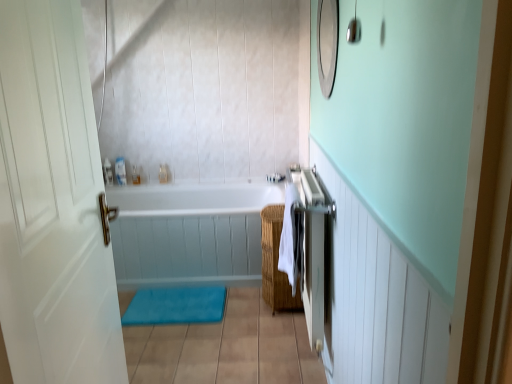
You are a GUI agent. You are given a task and a screenshot of the screen. Output one action in this format:
    pyautogui.click(x=<x>, y=<y>)
    Task: Click on the free space to the left of woven brown basket at center
    Image resolution: width=512 pixels, height=384 pixels.
    Given the screenshot: What is the action you would take?
    pos(243,299)